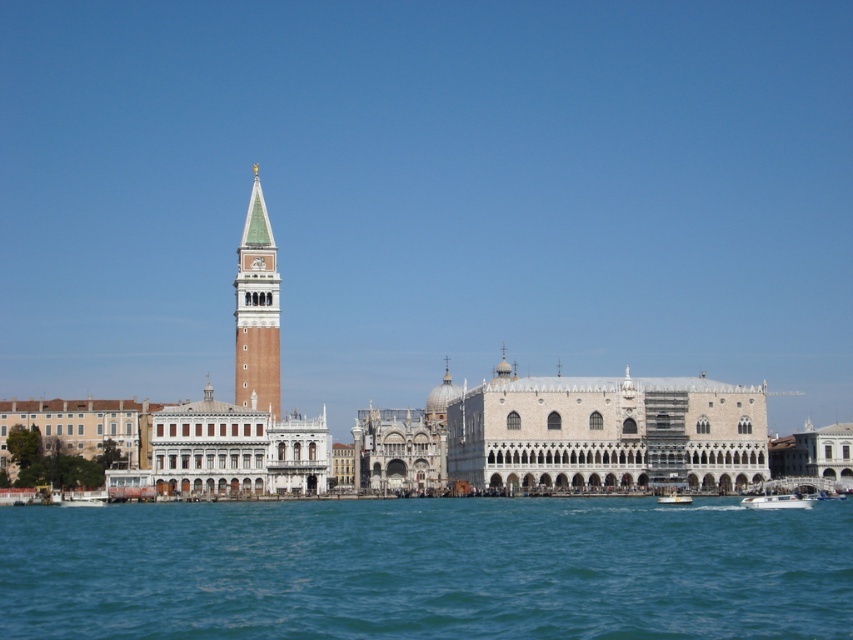
You are a tourist in Venice and want to take a photo of the white plastic boat at lower right while standing on the blue water at lower center. Is this possible?

The blue water at lower center is positioned on the left side of the white plastic boat at lower right. Since you can stand on the blue water at lower center, you can take a photo of the white plastic boat at lower right from there.

You are standing on the deck of a gondola in Venice and see the blue water at lower center and the white plastic boat at lower right. If your gondola is 5 meters long, can you safely maneuver your gondola between them without hitting either?

The blue water at lower center is 31.38 meters away from the white plastic boat at lower right. Since your gondola is only 5 meters long, there is sufficient space to maneuver safely between them.